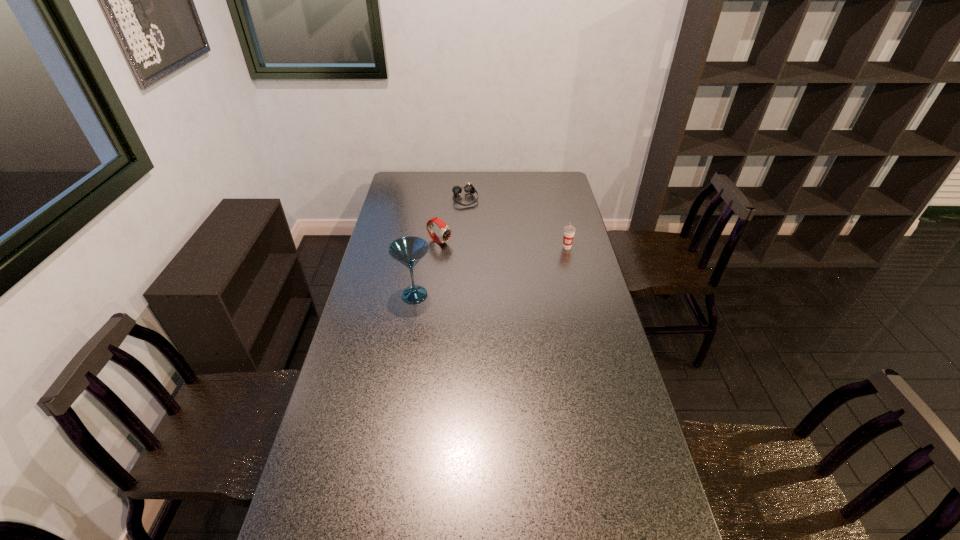
Identify the location of free space at the right edge. (591, 423).

In the image, there is a desktop. At what (x,y) coordinates should I click in order to perform the action: click on vacant space at the far left corner. Please return your answer as a coordinate pair (x, y). This screenshot has width=960, height=540. Looking at the image, I should click on (394, 190).

This screenshot has height=540, width=960. In the image, there is a desktop. What are the coordinates of `vacant space at the far right corner` in the screenshot? It's located at (538, 186).

This screenshot has width=960, height=540. In the image, there is a desktop. Find the location of `vacant space at the near right corner`. vacant space at the near right corner is located at coordinates (609, 531).

This screenshot has width=960, height=540. Identify the location of unoccupied position between the cup and the nearest object. (491, 271).

Where is `free space between the second shortest object and the farthest object`? free space between the second shortest object and the farthest object is located at coordinates (452, 220).

Find the location of a particular element. Image resolution: width=960 pixels, height=540 pixels. free space between the farthest object and the third tallest object is located at coordinates (452, 220).

The height and width of the screenshot is (540, 960). What are the coordinates of `vacant area between the third shortest object and the watch` in the screenshot? It's located at (503, 245).

At what (x,y) coordinates should I click in order to perform the action: click on vacant space in between the second tallest object and the martini. Please return your answer as a coordinate pair (x, y). The image size is (960, 540). Looking at the image, I should click on (491, 271).

Identify the location of free space between the farthest object and the third tallest object. (452, 220).